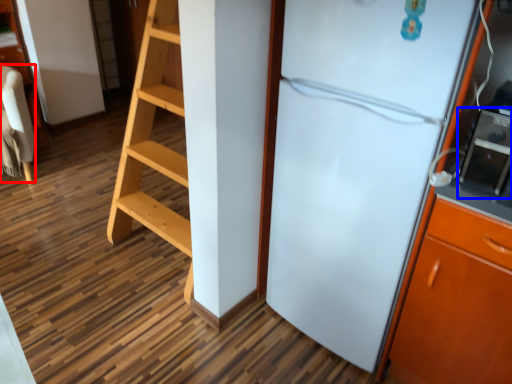
Question: Which object appears farthest to the camera in this image, furniture (highlighted by a red box) or appliance (highlighted by a blue box)?

Choices:
 (A) furniture
 (B) appliance

Answer: (A)